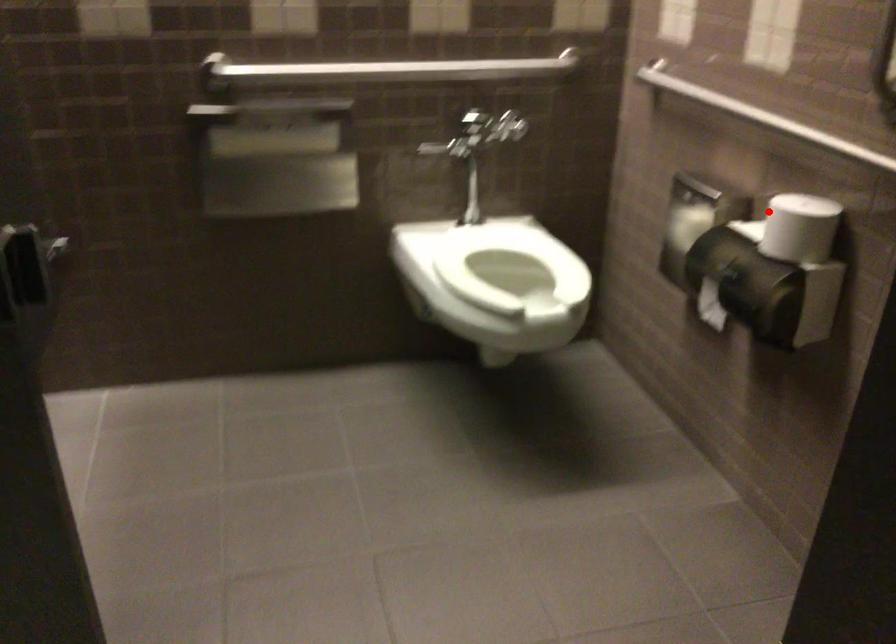
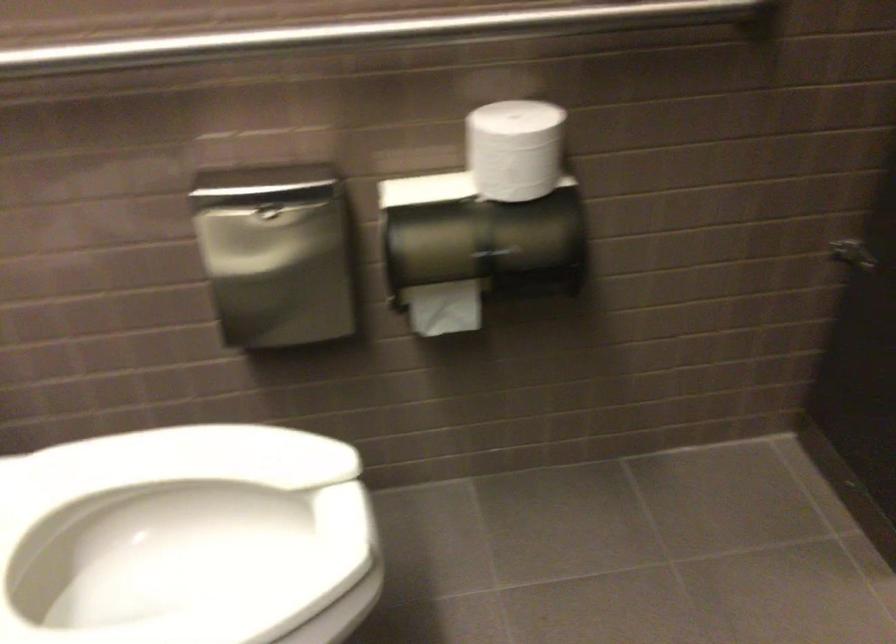
Question: I am providing you with two images of the same scene from different viewpoints. Given a red point in image1, look at the same physical point in image2. Is it:

Choices:
 (A) Closer to the viewpoint
 (B) Farther from the viewpoint

Answer: (A)